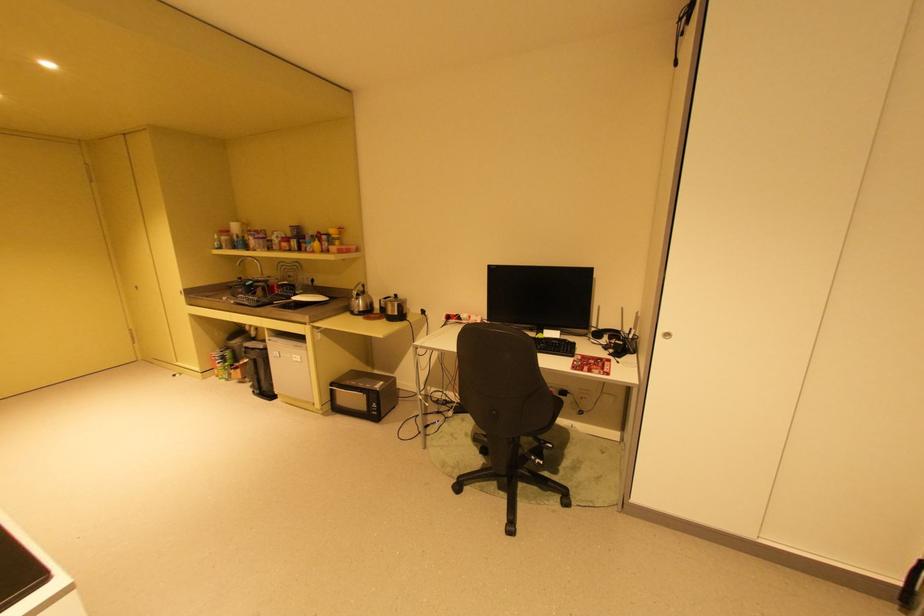
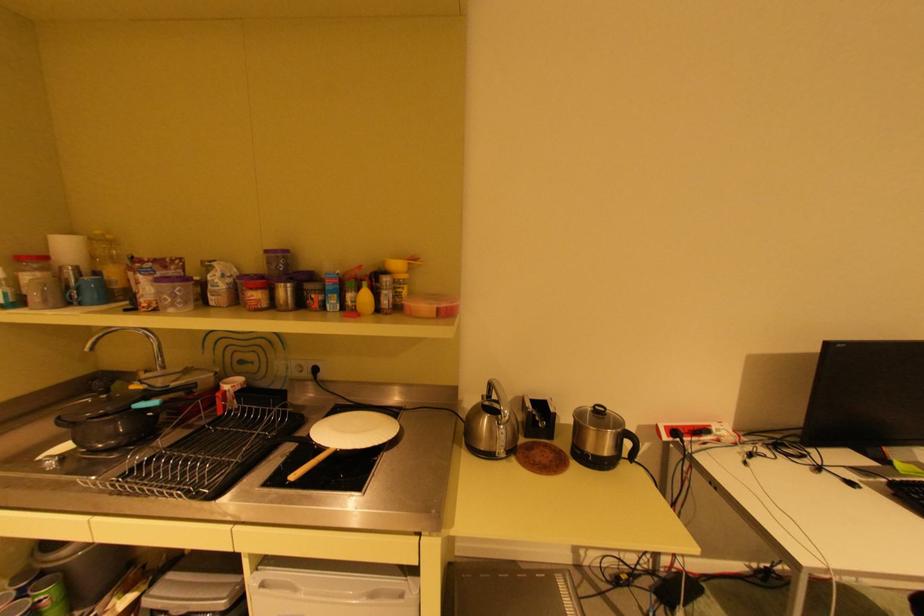
Find the pixel in the second image that matches (x=322, y=249) in the first image.

(367, 309)